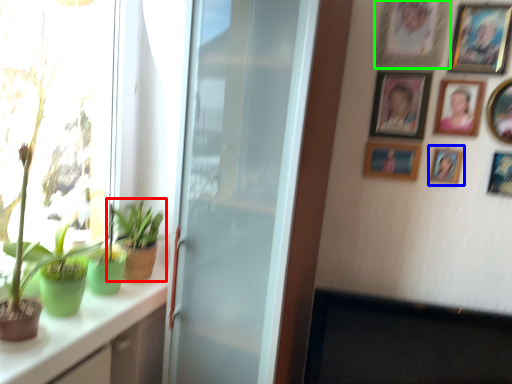
Question: Which object is the closest to the houseplant (highlighted by a red box)? Choose among these: picture frame (highlighted by a blue box) or picture frame (highlighted by a green box).

Choices:
 (A) picture frame
 (B) picture frame

Answer: (A)